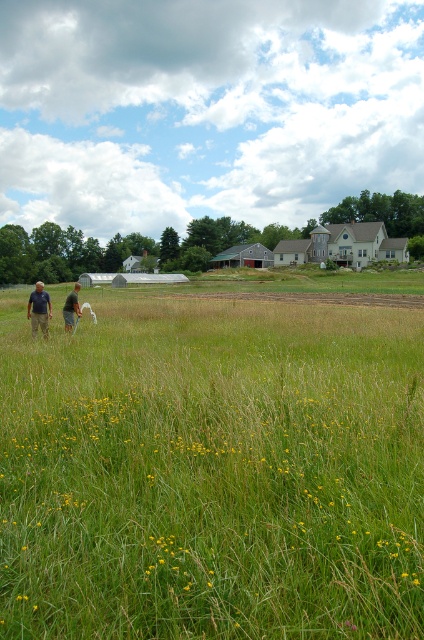
Where is `matte black shirts at lower left`? Image resolution: width=424 pixels, height=640 pixels. matte black shirts at lower left is located at coordinates (39, 308).

The image size is (424, 640). I want to click on matte black shirts at lower left, so click(x=39, y=308).

Is green grassy field at lower left to the right of light brown fabric shirt at center from the viewer's perspective?

Correct, you'll find green grassy field at lower left to the right of light brown fabric shirt at center.

The height and width of the screenshot is (640, 424). I want to click on green grassy field at lower left, so click(212, 472).

Can you confirm if dark blue shirt at left is smaller than light brown fabric shirt at center?

Incorrect, dark blue shirt at left is not smaller in size than light brown fabric shirt at center.

Which is more to the right, dark blue shirt at left or light brown fabric shirt at center?

From the viewer's perspective, light brown fabric shirt at center appears more on the right side.

Where is `dark blue shirt at left`? The width and height of the screenshot is (424, 640). dark blue shirt at left is located at coordinates (39, 308).

You are a GUI agent. You are given a task and a screenshot of the screen. Output one action in this format:
    pyautogui.click(x=<x>, y=<y>)
    Task: Click on the dark blue shirt at left
    This screenshot has width=424, height=640.
    Given the screenshot: What is the action you would take?
    (x=39, y=308)